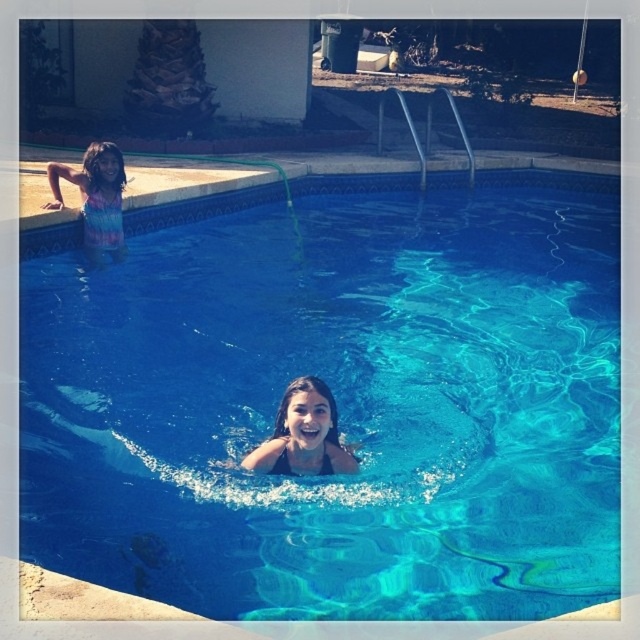
Can you confirm if transparent blue water at center is bigger than smooth skin child at center?

Yes.

Does point (157, 404) lie in front of point (324, 404)?

No.

Where is `transparent blue water at center`? The width and height of the screenshot is (640, 640). transparent blue water at center is located at coordinates point(337,401).

Is point (464, 324) closer to camera compared to point (112, 227)?

No.

Between transparent blue water at center and tie-dye fabric at upper left, which one is positioned lower?

Positioned lower is transparent blue water at center.

Describe the element at coordinates (337, 401) in the screenshot. I see `transparent blue water at center` at that location.

You are a GUI agent. You are given a task and a screenshot of the screen. Output one action in this format:
    pyautogui.click(x=<x>, y=<y>)
    Task: Click on the transparent blue water at center
    This screenshot has height=640, width=640.
    Given the screenshot: What is the action you would take?
    pyautogui.click(x=337, y=401)

Can you confirm if smooth skin child at center is positioned to the right of tie-dye fabric at upper left?

Indeed, smooth skin child at center is positioned on the right side of tie-dye fabric at upper left.

Does point (323, 464) come behind point (115, 196)?

No.

Find the location of a particular element. smooth skin child at center is located at coordinates (304, 435).